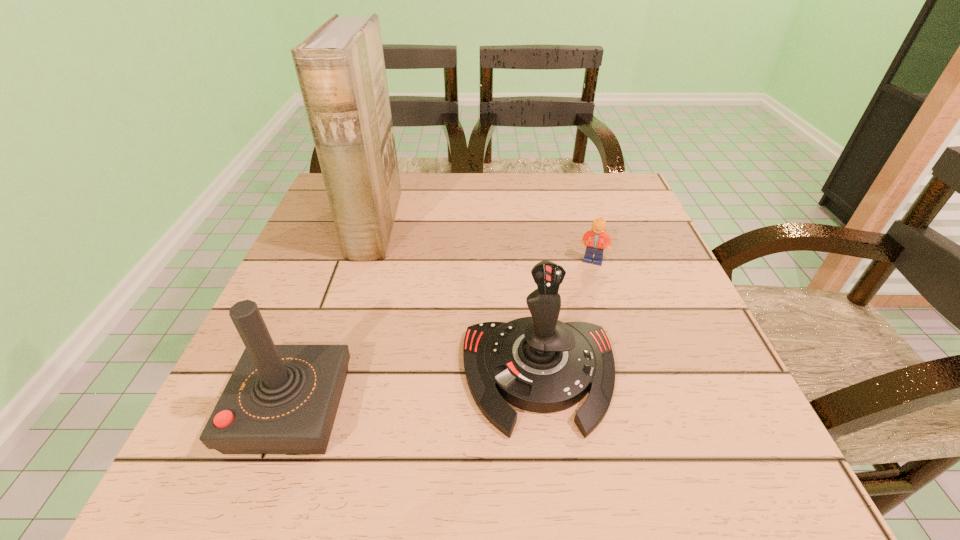
At what (x,y) coordinates should I click in order to perform the action: click on object that stands as the third closest to the shortest object. Please return your answer as a coordinate pair (x, y). The height and width of the screenshot is (540, 960). Looking at the image, I should click on (280, 399).

Identify the location of free space in the image that satisfies the following two spatial constraints: 1. on the front-facing side of the shortest object; 2. on the rectangular base of the left joystick. (638, 409).